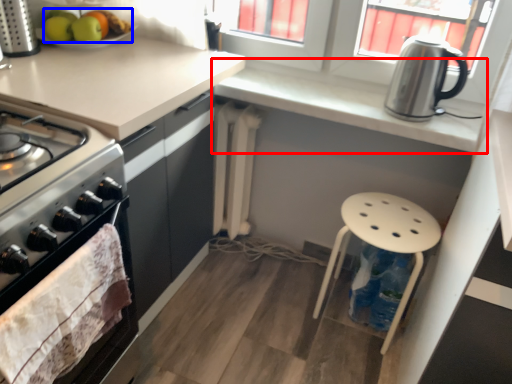
Question: Which object appears closest to the camera in this image, countertop (highlighted by a red box) or fruit (highlighted by a blue box)?

Choices:
 (A) countertop
 (B) fruit

Answer: (A)